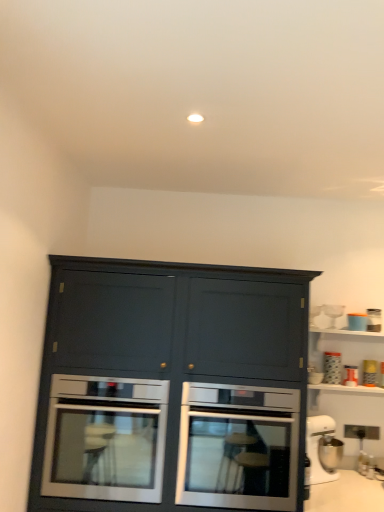
In order to face stainless steel oven at lower left, positioned as the first oven in left-to-right order, should I rotate leftwards or rightwards?

To face it directly, rotate left by 9.957 degrees.

This screenshot has width=384, height=512. Identify the location of metallic silver toaster at upper right, acting as the sixth appliance starting from the bottom. (374, 320).

You are a GUI agent. You are given a task and a screenshot of the screen. Output one action in this format:
    pyautogui.click(x=<x>, y=<y>)
    Task: Click on the metallic silver toaster at upper right, positioned as the second appliance in bottom-to-top order
    This screenshot has height=512, width=384.
    Given the screenshot: What is the action you would take?
    pyautogui.click(x=370, y=373)

You are a GUI agent. You are given a task and a screenshot of the screen. Output one action in this format:
    pyautogui.click(x=<x>, y=<y>)
    Task: Click on the orange matte jar at upper right, the third appliance when ordered from bottom to top
    This screenshot has height=512, width=384.
    Given the screenshot: What is the action you would take?
    pyautogui.click(x=350, y=376)

In order to face white plastic stand mixer at lower right, which is the 7th appliance from top to bottom, should I rotate leftwards or rightwards?

To align with it, rotate right about 17.105°.

Find the location of a particular element. This screenshot has height=512, width=384. matte dark blue cabinet at center is located at coordinates (171, 388).

Is orange matte jar at upper right, the third appliance when ordered from bottom to top, inside stainless steel oven at center, which is counted as the 1th oven, starting from the right?

No, orange matte jar at upper right, the third appliance when ordered from bottom to top, is not surrounded by stainless steel oven at center, which is counted as the 1th oven, starting from the right.

How distant is stainless steel oven at center, which appears as the second oven when viewed from the left, from orange matte jar at upper right, the third appliance when ordered from bottom to top?

stainless steel oven at center, which appears as the second oven when viewed from the left, and orange matte jar at upper right, the third appliance when ordered from bottom to top, are 37.03 inches apart from each other.

How different are the orientations of stainless steel oven at center, which is counted as the 1th oven, starting from the right, and orange matte jar at upper right, the 5th appliance in the top-to-bottom sequence, in degrees?

There is a 0.658-degree angle between the facing directions of stainless steel oven at center, which is counted as the 1th oven, starting from the right, and orange matte jar at upper right, the 5th appliance in the top-to-bottom sequence.

Considering the relative positions of stainless steel oven at center, which appears as the second oven when viewed from the left, and orange matte jar at upper right, the third appliance when ordered from bottom to top, in the image provided, is stainless steel oven at center, which appears as the second oven when viewed from the left, to the left of orange matte jar at upper right, the third appliance when ordered from bottom to top, from the viewer's perspective?

Indeed, stainless steel oven at center, which appears as the second oven when viewed from the left, is positioned on the left side of orange matte jar at upper right, the third appliance when ordered from bottom to top.

Does matte blue container at upper right, arranged as the fifth appliance when ordered from the bottom, appear on the right side of stainless steel oven at lower left, positioned as the first oven in left-to-right order?

Indeed, matte blue container at upper right, arranged as the fifth appliance when ordered from the bottom, is positioned on the right side of stainless steel oven at lower left, positioned as the first oven in left-to-right order.

Between matte blue container at upper right, the 3th appliance when ordered from top to bottom, and stainless steel oven at lower left, positioned as the first oven in left-to-right order, which one has larger size?

With larger size is stainless steel oven at lower left, positioned as the first oven in left-to-right order.

Which object is more forward, matte blue container at upper right, the 3th appliance when ordered from top to bottom, or stainless steel oven at lower left, positioned as the first oven in left-to-right order?

stainless steel oven at lower left, positioned as the first oven in left-to-right order, is more forward.

From the image's perspective, which one is positioned higher, matte blue container at upper right, the 3th appliance when ordered from top to bottom, or stainless steel oven at lower left, positioned as the first oven in left-to-right order?

matte blue container at upper right, the 3th appliance when ordered from top to bottom, is shown above in the image.

Which of these two, clear glass wine glass at upper right, which is the 1th appliance in top-to-bottom order, or stainless steel oven at lower left, positioned as the first oven in left-to-right order, is bigger?

Bigger between the two is stainless steel oven at lower left, positioned as the first oven in left-to-right order.

Image resolution: width=384 pixels, height=512 pixels. Find the location of `the 3rd appliance counting from the right side of the stainless steel oven at lower left, which is the 2th oven in right-to-left order`. the 3rd appliance counting from the right side of the stainless steel oven at lower left, which is the 2th oven in right-to-left order is located at coordinates (333, 313).

Is clear glass wine glass at upper right, which is the 1th appliance in top-to-bottom order, positioned far away from stainless steel oven at lower left, which is the 2th oven in right-to-left order?

clear glass wine glass at upper right, which is the 1th appliance in top-to-bottom order, is positioned a significant distance from stainless steel oven at lower left, which is the 2th oven in right-to-left order.

Which of these two, clear glass wine glass at upper right, the seventh appliance in the bottom-to-top sequence, or stainless steel oven at lower left, which is the 2th oven in right-to-left order, stands taller?

Standing taller between the two is stainless steel oven at lower left, which is the 2th oven in right-to-left order.

Based on their positions, is metallic silver toaster at upper right, positioned as the second appliance in bottom-to-top order, located to the left or right of matte dark blue cabinet at center?

From the image, it's evident that metallic silver toaster at upper right, positioned as the second appliance in bottom-to-top order, is to the right of matte dark blue cabinet at center.

Where is `appliance that is the 1st one when counting upward from the matte dark blue cabinet at center (from the image's perspective)`? Image resolution: width=384 pixels, height=512 pixels. appliance that is the 1st one when counting upward from the matte dark blue cabinet at center (from the image's perspective) is located at coordinates (370, 373).

Between point (373, 377) and point (232, 273), which one is positioned in front?

The point (232, 273) is in front.

Is matte dark blue cabinet at center surrounded by metallic silver toaster at upper right, which ranks as the 6th appliance in top-to-bottom order?

That's incorrect, matte dark blue cabinet at center is not inside metallic silver toaster at upper right, which ranks as the 6th appliance in top-to-bottom order.

Considering the sizes of objects clear glass wine glass at upper right, the seventh appliance in the bottom-to-top sequence, and stainless steel oven at center, which is counted as the 1th oven, starting from the right, in the image provided, who is wider, clear glass wine glass at upper right, the seventh appliance in the bottom-to-top sequence, or stainless steel oven at center, which is counted as the 1th oven, starting from the right,?

Wider between the two is stainless steel oven at center, which is counted as the 1th oven, starting from the right.

How many degrees apart are the facing directions of clear glass wine glass at upper right, which is the 1th appliance in top-to-bottom order, and stainless steel oven at center, which is counted as the 1th oven, starting from the right?

clear glass wine glass at upper right, which is the 1th appliance in top-to-bottom order, and stainless steel oven at center, which is counted as the 1th oven, starting from the right, are facing 0.00732 degrees away from each other.

Considering their positions, is clear glass wine glass at upper right, which is the 1th appliance in top-to-bottom order, located in front of or behind stainless steel oven at center, which is counted as the 1th oven, starting from the right?

In the image, clear glass wine glass at upper right, which is the 1th appliance in top-to-bottom order, appears behind stainless steel oven at center, which is counted as the 1th oven, starting from the right.

Measure the distance between metallic silver toaster at upper right, which ranks as the 6th appliance in top-to-bottom order, and white plastic stand mixer at lower right, which is the 7th appliance from top to bottom.

metallic silver toaster at upper right, which ranks as the 6th appliance in top-to-bottom order, is 19.12 inches away from white plastic stand mixer at lower right, which is the 7th appliance from top to bottom.

Locate an element on the screen. The width and height of the screenshot is (384, 512). the 5th appliance to the left of the metallic silver toaster at upper right, which ranks as the 6th appliance in top-to-bottom order, starting your count from the anchor is located at coordinates coord(317,446).

Which is more to the left, metallic silver toaster at upper right, positioned as the second appliance in bottom-to-top order, or white plastic stand mixer at lower right, which is the 7th appliance from top to bottom?

white plastic stand mixer at lower right, which is the 7th appliance from top to bottom.

Relative to white plastic stand mixer at lower right, which is the 7th appliance from top to bottom, is metallic silver toaster at upper right, which ranks as the 6th appliance in top-to-bottom order, in front or behind?

metallic silver toaster at upper right, which ranks as the 6th appliance in top-to-bottom order, is behind white plastic stand mixer at lower right, which is the 7th appliance from top to bottom.

From a real-world perspective, is orange matte jar at upper right, the 5th appliance in the top-to-bottom sequence, on metallic silver toaster at upper right, the second appliance from the top?

Actually, orange matte jar at upper right, the 5th appliance in the top-to-bottom sequence, is physically below metallic silver toaster at upper right, the second appliance from the top, in the real world.

Between orange matte jar at upper right, the third appliance when ordered from bottom to top, and metallic silver toaster at upper right, acting as the sixth appliance starting from the bottom, which one is positioned in front?

orange matte jar at upper right, the third appliance when ordered from bottom to top, is more forward.

From the image's perspective, is orange matte jar at upper right, the 5th appliance in the top-to-bottom sequence, below metallic silver toaster at upper right, acting as the sixth appliance starting from the bottom?

Yes, from the image's perspective, orange matte jar at upper right, the 5th appliance in the top-to-bottom sequence, is below metallic silver toaster at upper right, acting as the sixth appliance starting from the bottom.

There is a orange matte jar at upper right, the 5th appliance in the top-to-bottom sequence. Where is `the 1st oven below it (from a real-world perspective)`? The width and height of the screenshot is (384, 512). the 1st oven below it (from a real-world perspective) is located at coordinates (238, 447).

From the image's perspective, which appliance is the 4th one above the stainless steel oven at lower left, positioned as the first oven in left-to-right order? Please provide its 2D coordinates.

[(357, 321)]

Based on their spatial positions, is matte blue container at upper right, arranged as the fifth appliance when ordered from the bottom, or matte dark blue cabinet at center closer to white plastic stand mixer at lower right, which is the 7th appliance from top to bottom?

matte blue container at upper right, arranged as the fifth appliance when ordered from the bottom.

When comparing their distances from matte blue container at upper right, arranged as the fifth appliance when ordered from the bottom, does clear glass wine glass at upper right, which is the 1th appliance in top-to-bottom order, or matte white jar at upper right, which is the fourth appliance in bottom-to-top order, seem further?

matte white jar at upper right, which is the fourth appliance in bottom-to-top order.

When comparing their distances from metallic silver toaster at upper right, positioned as the second appliance in bottom-to-top order, does matte white jar at upper right, which is the fourth appliance in bottom-to-top order, or stainless steel oven at lower left, positioned as the first oven in left-to-right order, seem closer?

Based on the image, matte white jar at upper right, which is the fourth appliance in bottom-to-top order, appears to be nearer to metallic silver toaster at upper right, positioned as the second appliance in bottom-to-top order.

When comparing their distances from orange matte jar at upper right, the 5th appliance in the top-to-bottom sequence, does stainless steel oven at lower left, positioned as the first oven in left-to-right order, or matte blue container at upper right, the 3th appliance when ordered from top to bottom, seem further?

stainless steel oven at lower left, positioned as the first oven in left-to-right order.

Considering their positions, is stainless steel oven at lower left, positioned as the first oven in left-to-right order, positioned closer to orange matte jar at upper right, the third appliance when ordered from bottom to top, than stainless steel oven at center, which appears as the second oven when viewed from the left?

stainless steel oven at center, which appears as the second oven when viewed from the left.

From the image, which object appears to be farther from matte blue container at upper right, the 3th appliance when ordered from top to bottom, orange matte jar at upper right, the third appliance when ordered from bottom to top, or stainless steel oven at center, which is counted as the 1th oven, starting from the right?

stainless steel oven at center, which is counted as the 1th oven, starting from the right, is positioned further to the anchor matte blue container at upper right, the 3th appliance when ordered from top to bottom.

Based on their spatial positions, is matte dark blue cabinet at center or stainless steel oven at center, which is counted as the 1th oven, starting from the right, further from orange matte jar at upper right, the third appliance when ordered from bottom to top?

The object further to orange matte jar at upper right, the third appliance when ordered from bottom to top, is matte dark blue cabinet at center.

Looking at the image, which one is located further to orange matte jar at upper right, the 5th appliance in the top-to-bottom sequence, stainless steel oven at center, which appears as the second oven when viewed from the left, or white plastic stand mixer at lower right, the first appliance positioned from the bottom?

Based on the image, stainless steel oven at center, which appears as the second oven when viewed from the left, appears to be further to orange matte jar at upper right, the 5th appliance in the top-to-bottom sequence.

The height and width of the screenshot is (512, 384). In order to click on oven between matte dark blue cabinet at center and clear glass wine glass at upper right, which is the 1th appliance in top-to-bottom order, in the horizontal direction in this screenshot , I will do `click(238, 447)`.

Locate an element on the screen. appliance between orange matte jar at upper right, the 5th appliance in the top-to-bottom sequence, and white plastic stand mixer at lower right, the first appliance positioned from the bottom, from top to bottom is located at coordinates (370, 373).

At what (x,y) coordinates should I click in order to perform the action: click on cabinetry between stainless steel oven at lower left, which is the 2th oven in right-to-left order, and matte white jar at upper right, the fourth appliance viewed from the top, in the horizontal direction. Please return your answer as a coordinate pair (x, y). Looking at the image, I should click on (171, 388).

The image size is (384, 512). In order to click on cabinetry between stainless steel oven at lower left, positioned as the first oven in left-to-right order, and clear glass wine glass at upper right, the seventh appliance in the bottom-to-top sequence, in the horizontal direction in this screenshot , I will do `click(171, 388)`.